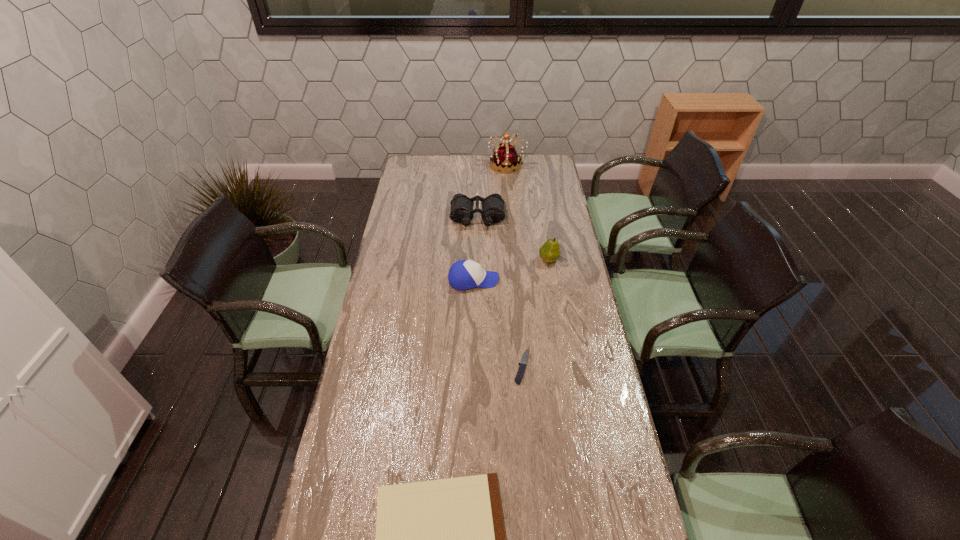
Identify the location of vacant region that satisfies the following two spatial constraints: 1. through the eyepieces of the binoculars; 2. on the left side of the third farthest object. This screenshot has width=960, height=540. (477, 260).

This screenshot has width=960, height=540. I want to click on vacant space that satisfies the following two spatial constraints: 1. on the front-facing side of the tallest object; 2. on the left side of the pear, so click(x=516, y=260).

Identify the location of free spot that satisfies the following two spatial constraints: 1. through the eyepieces of the fourth nearest object; 2. on the left side of the fifth nearest object. (477, 260).

This screenshot has width=960, height=540. Find the location of `free space in the image that satisfies the following two spatial constraints: 1. on the front-facing side of the third nearest object; 2. on the back side of the second nearest object`. free space in the image that satisfies the following two spatial constraints: 1. on the front-facing side of the third nearest object; 2. on the back side of the second nearest object is located at coordinates pos(472,367).

Locate an element on the screen. free region that satisfies the following two spatial constraints: 1. on the back side of the fifth shortest object; 2. on the front-facing side of the tiara is located at coordinates (533, 165).

Identify the location of vacant area in the image that satisfies the following two spatial constraints: 1. on the front-facing side of the tiara; 2. on the left side of the fourth nearest object. (516, 260).

The width and height of the screenshot is (960, 540). Find the location of `free point that satisfies the following two spatial constraints: 1. on the back side of the fifth shortest object; 2. on the front-facing side of the tiara`. free point that satisfies the following two spatial constraints: 1. on the back side of the fifth shortest object; 2. on the front-facing side of the tiara is located at coordinates (533, 165).